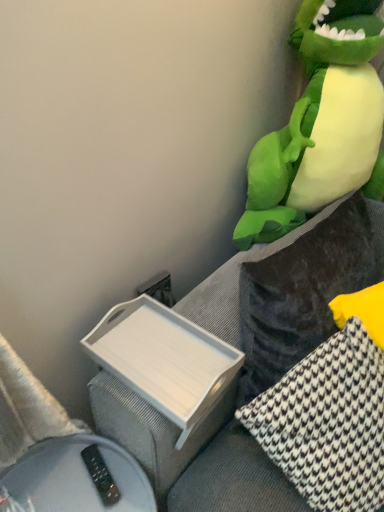
Question: From the image's perspective, relative to white wood tray at lower left, is white houndstooth pillow at right, which ranks as the 2th pillow in left-to-right order, above or below?

Choices:
 (A) above
 (B) below

Answer: (A)

Question: In terms of height, does white houndstooth pillow at right, marked as the 1th pillow in a right-to-left arrangement, look taller or shorter compared to white wood tray at lower left?

Choices:
 (A) short
 (B) tall

Answer: (B)

Question: Estimate the real-world distances between objects in this image. Which object is farther from the white houndstooth fabric pillow at right, which appears as the 1th pillow when viewed from the left?

Choices:
 (A) white wood tray at lower left
 (B) white plastic tray at lower left
 (C) velvet dark gray couch at right
 (D) white houndstooth pillow at right, which ranks as the 2th pillow in left-to-right order
 (E) green plush toy at upper right

Answer: (E)

Question: Considering the real-world distances, which object is closest to the white plastic tray at lower left?

Choices:
 (A) velvet dark gray couch at right
 (B) white houndstooth fabric pillow at right, the 2th pillow positioned from the right
 (C) white houndstooth pillow at right, which ranks as the 2th pillow in left-to-right order
 (D) green plush toy at upper right
 (E) white wood tray at lower left

Answer: (A)